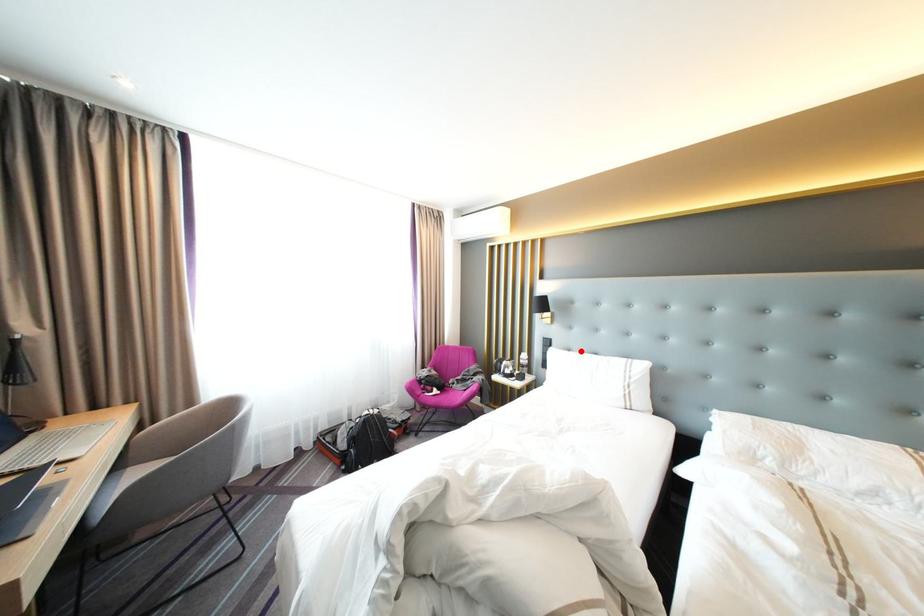
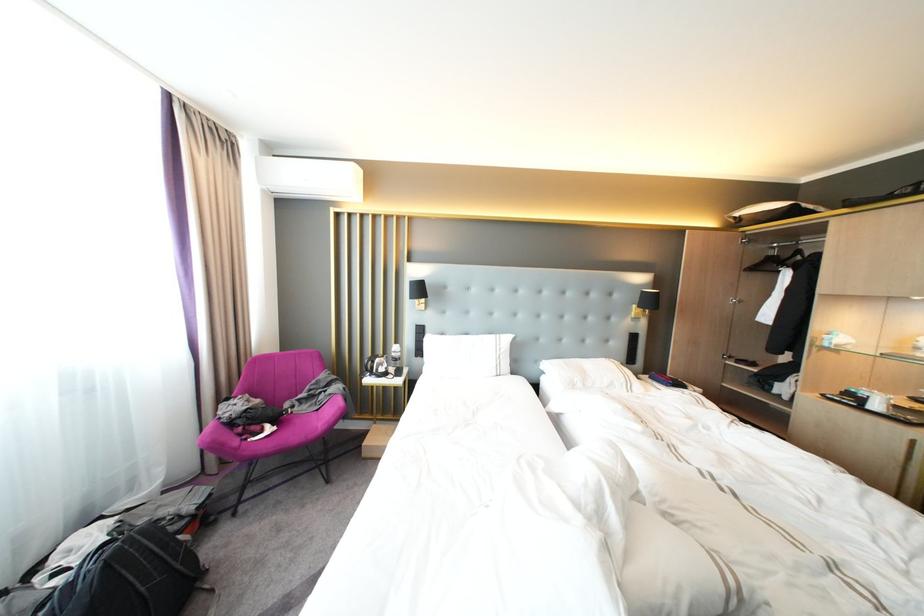
In the second image, find the point that corresponds to the highlighted location in the first image.

(455, 334)